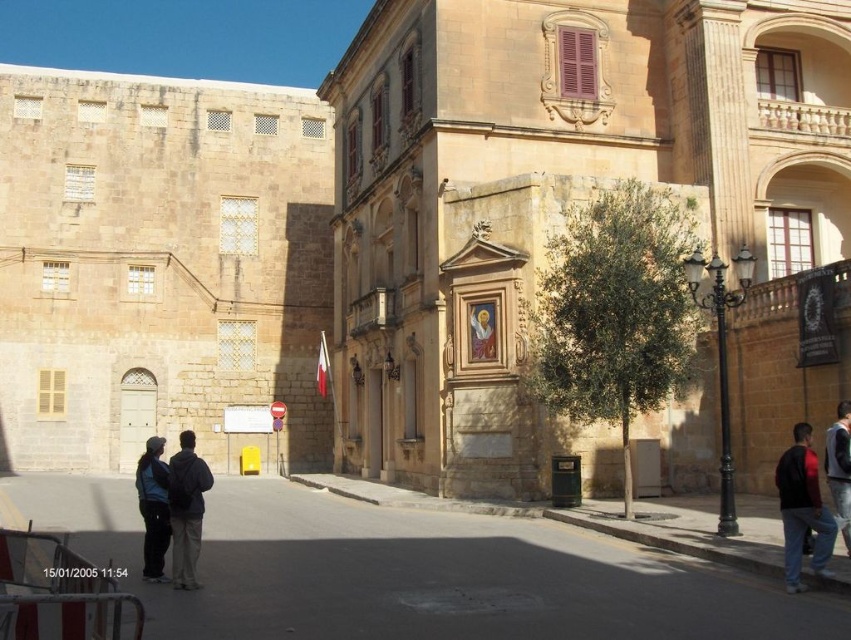
You are standing at the center of the street in front of the beige stone building. You need to locate the dark red jacket at lower right. Which direction should you look to find it?

You should look to your lower right direction to find the dark red jacket at lower right as it is located at point (x=802, y=508).